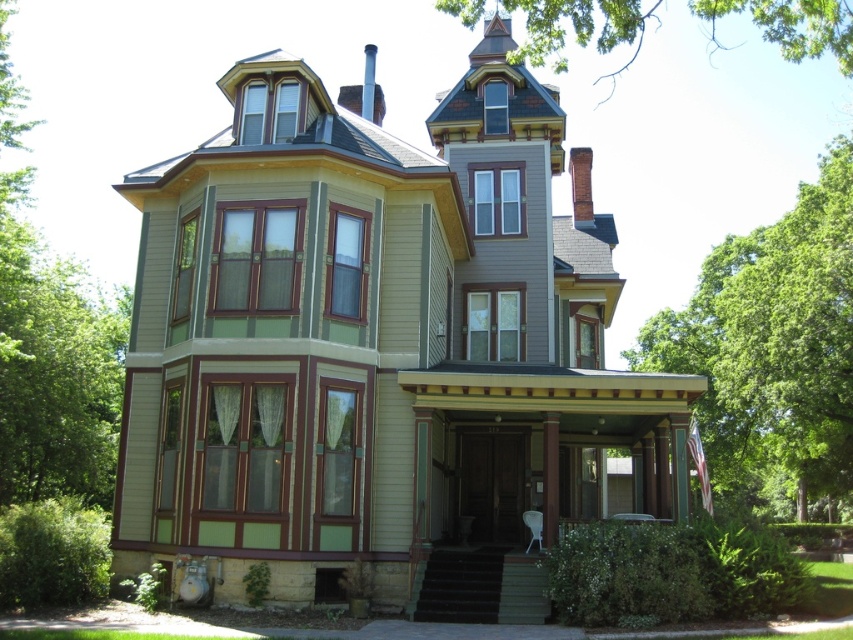
You are standing in front of the Victorian house and notice two green leafy trees in the background. Which tree, the green leafy tree at upper right or the green leafy tree at upper center, appears smaller in size?

The green leafy tree at upper right has a smaller size compared to the green leafy tree at upper center.

You are standing in front of the Victorian house and notice a specific point marked at coordinates (773, 346). Based on the scene description, can you identify what object this point is located on?

The point at coordinates (773, 346) is located on the green leafy tree at upper right.